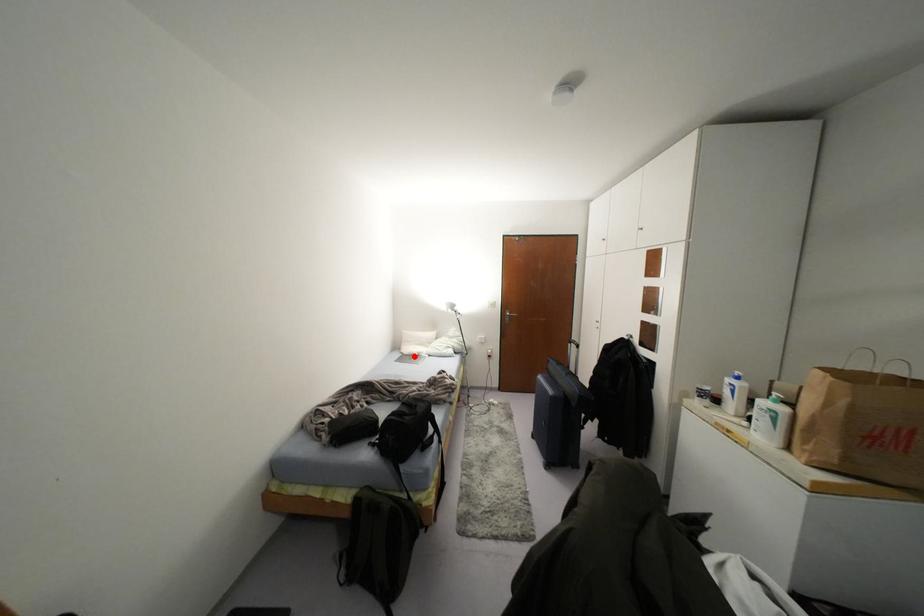
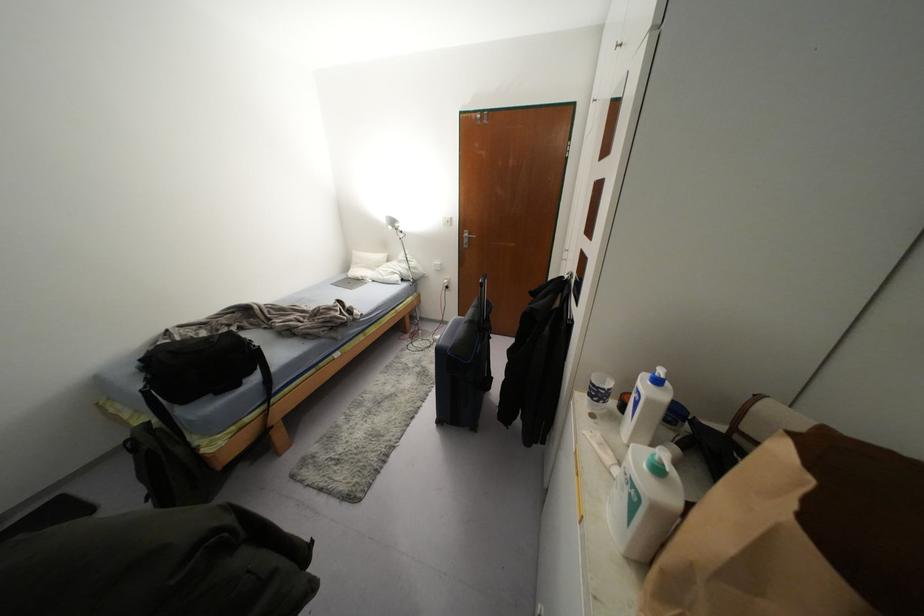
In the second image, find the point that corresponds to the highlighted location in the first image.

(358, 281)